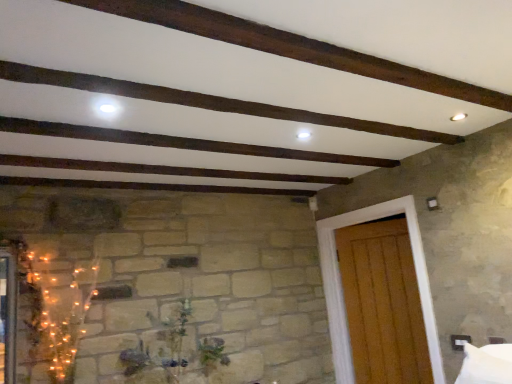
Question: Is wooden door at right in front of or behind green matte plant at center in the image?

Choices:
 (A) behind
 (B) front

Answer: (A)

Question: Considering the positions of wooden door at right and green matte plant at center in the image, is wooden door at right wider or thinner than green matte plant at center?

Choices:
 (A) wide
 (B) thin

Answer: (B)

Question: From a real-world perspective, is wooden door at right physically located above or below green matte plant at center?

Choices:
 (A) above
 (B) below

Answer: (A)

Question: Visually, is green matte plant at center positioned to the left or to the right of wooden door at right?

Choices:
 (A) right
 (B) left

Answer: (B)

Question: Is point (161, 332) closer or farther from the camera than point (332, 301)?

Choices:
 (A) closer
 (B) farther

Answer: (A)

Question: From a real-world perspective, is green matte plant at center above or below wooden door at right?

Choices:
 (A) above
 (B) below

Answer: (B)

Question: From the image's perspective, is green matte plant at center positioned above or below wooden door at right?

Choices:
 (A) above
 (B) below

Answer: (B)